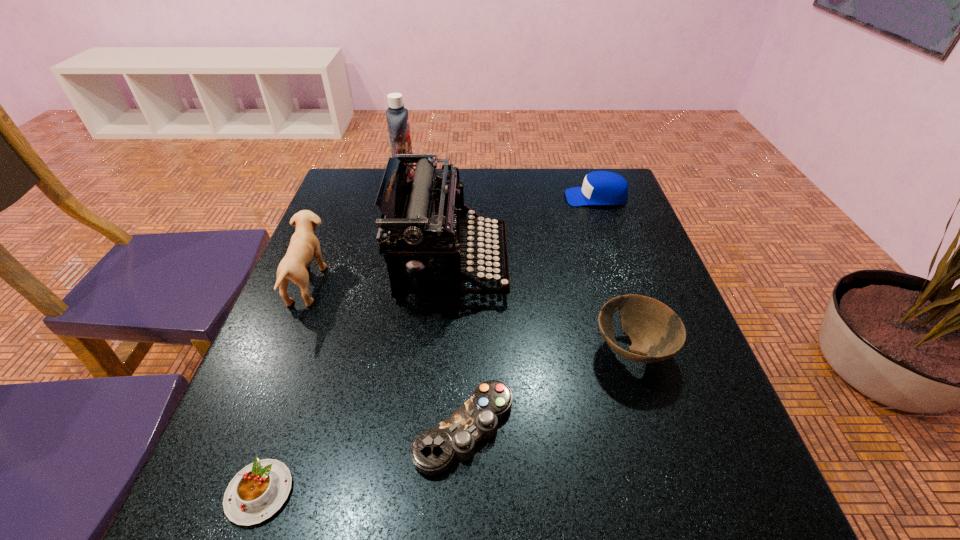
You are a GUI agent. You are given a task and a screenshot of the screen. Output one action in this format:
    pyautogui.click(x=<x>, y=<y>)
    Task: Click on the object that is the fourth closest to the control
    
    Given the screenshot: What is the action you would take?
    pyautogui.click(x=304, y=245)

Select which object is the sixth closest to the typewriter. Please provide its 2D coordinates. Your answer should be formatted as a tuple, i.e. [(x, y)], where the tuple contains the x and y coordinates of a point satisfying the conditions above.

[(258, 491)]

At what (x,y) coordinates should I click in order to perform the action: click on free location that satisfies the following two spatial constraints: 1. on the typing side of the typewriter; 2. on the right side of the control. Please return your answer as a coordinate pair (x, y). The height and width of the screenshot is (540, 960). Looking at the image, I should click on (440, 429).

Locate an element on the screen. free point that satisfies the following two spatial constraints: 1. on the front label of the farthest object; 2. on the back side of the control is located at coordinates (345, 429).

Find the location of `vacant region that satisfies the following two spatial constraints: 1. on the left side of the control; 2. on the right side of the third tallest object`. vacant region that satisfies the following two spatial constraints: 1. on the left side of the control; 2. on the right side of the third tallest object is located at coordinates (249, 429).

This screenshot has width=960, height=540. Find the location of `free location that satisfies the following two spatial constraints: 1. on the typing side of the control; 2. on the right side of the typewriter`. free location that satisfies the following two spatial constraints: 1. on the typing side of the control; 2. on the right side of the typewriter is located at coordinates (440, 429).

In order to click on vacant space that satisfies the following two spatial constraints: 1. on the typing side of the control; 2. on the left side of the typewriter in this screenshot , I will do `click(440, 429)`.

In order to click on free space that satisfies the following two spatial constraints: 1. on the left side of the fifth shortest object; 2. on the back side of the control in this screenshot , I will do `click(249, 429)`.

This screenshot has height=540, width=960. I want to click on free location that satisfies the following two spatial constraints: 1. on the typing side of the typewriter; 2. on the left side of the bowl, so click(445, 350).

Locate an element on the screen. The height and width of the screenshot is (540, 960). free location that satisfies the following two spatial constraints: 1. on the back side of the pudding; 2. on the left side of the bowl is located at coordinates (309, 350).